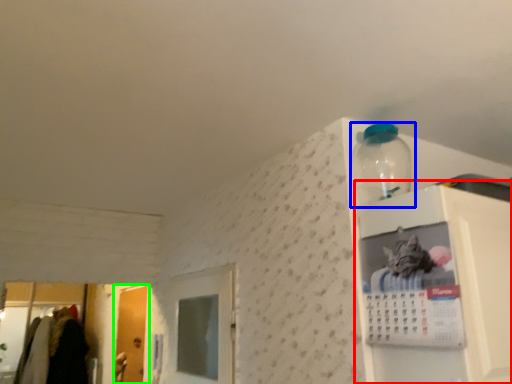
Question: Based on their relative distances, which object is farther from cabinet (highlighted by a red box)? Choose from bottle (highlighted by a blue box) and door (highlighted by a green box).

Choices:
 (A) bottle
 (B) door

Answer: (B)